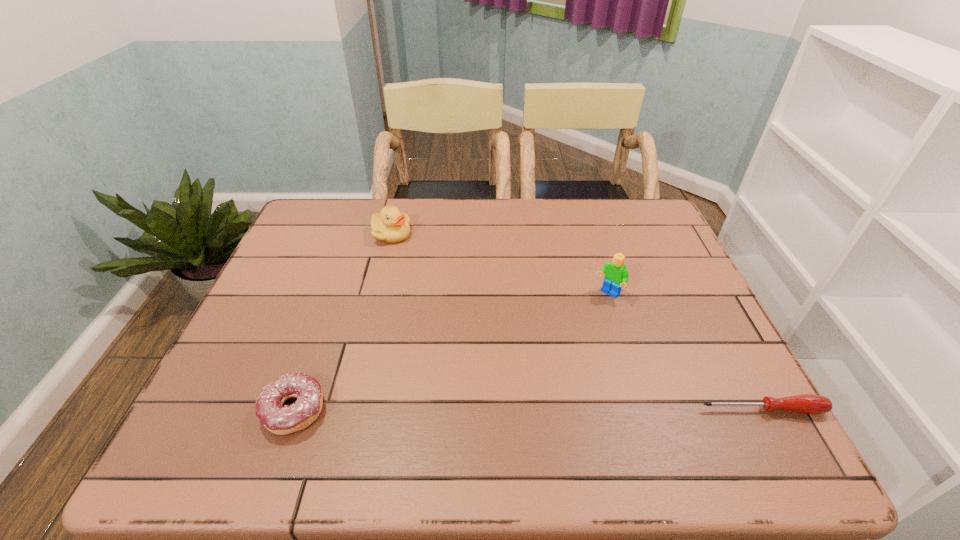
Locate an element on the screen. free spot between the duckling and the third object from left to right is located at coordinates (499, 264).

In order to click on unoccupied area between the third nearest object and the farthest object in this screenshot , I will do `click(499, 264)`.

The width and height of the screenshot is (960, 540). Find the location of `free spot between the doughnut and the tallest object`. free spot between the doughnut and the tallest object is located at coordinates (451, 352).

Where is `vacant space that is in between the Lego and the third tallest object`? vacant space that is in between the Lego and the third tallest object is located at coordinates (451, 352).

Locate an element on the screen. free spot between the second tallest object and the third object from left to right is located at coordinates (499, 264).

Where is `vacant space that's between the farthest object and the second object from right to left`? The width and height of the screenshot is (960, 540). vacant space that's between the farthest object and the second object from right to left is located at coordinates (499, 264).

The width and height of the screenshot is (960, 540). In order to click on vacant area between the doughnut and the third shortest object in this screenshot , I will do `click(343, 322)`.

Select which object is the closest to the Lego. Please provide its 2D coordinates. Your answer should be formatted as a tuple, i.e. [(x, y)], where the tuple contains the x and y coordinates of a point satisfying the conditions above.

[(807, 403)]

Locate an element on the screen. The image size is (960, 540). the closest object to the duckling is located at coordinates (281, 420).

You are a GUI agent. You are given a task and a screenshot of the screen. Output one action in this format:
    pyautogui.click(x=<x>, y=<y>)
    Task: Click on the free space that satisfies the following two spatial constraints: 1. on the back side of the second object from right to left; 2. on the right side of the doughnut
    This screenshot has width=960, height=540.
    Given the screenshot: What is the action you would take?
    pyautogui.click(x=334, y=294)